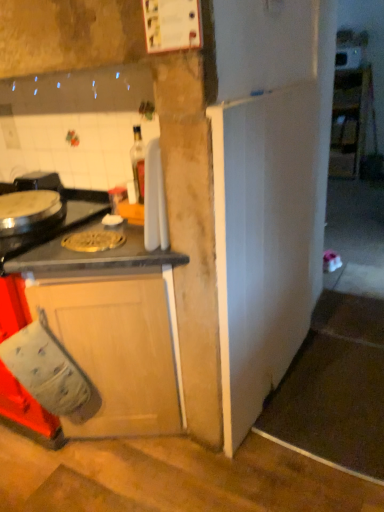
Where is `white glossy cabinet at upper right, marked as the second cabinetry in a left-to-right arrangement`? white glossy cabinet at upper right, marked as the second cabinetry in a left-to-right arrangement is located at coordinates (349, 121).

In order to face wooden cabinet at lower left, acting as the 2th cabinetry starting from the top, should I rotate leftwards or rightwards?

You should rotate left by 23.299 degrees.

You are a GUI agent. You are given a task and a screenshot of the screen. Output one action in this format:
    pyautogui.click(x=<x>, y=<y>)
    Task: Click on the shiny metallic burner at left
    
    Given the screenshot: What is the action you would take?
    pyautogui.click(x=58, y=221)

Measure the distance between gold metallic pizza pan at center and camera.

A distance of 1.47 meters exists between gold metallic pizza pan at center and camera.

The image size is (384, 512). Identify the location of white glossy cabinet at upper right, the first cabinetry positioned from the top. (349, 121).

From the picture: Which point is more distant from viewer, (332, 174) or (163, 256)?

The point (332, 174) is behind.

From the image's perspective, which one is positioned higher, white glossy cabinet at upper right, marked as the second cabinetry in a left-to-right arrangement, or wooden cabinet at lower left, acting as the 2th cabinetry starting from the top?

white glossy cabinet at upper right, marked as the second cabinetry in a left-to-right arrangement, appears higher in the image.

Between white glossy cabinet at upper right, the first cabinetry positioned from the top, and wooden cabinet at lower left, acting as the first cabinetry starting from the bottom, which one has less height?

wooden cabinet at lower left, acting as the first cabinetry starting from the bottom, is shorter.

Is white glossy cabinet at upper right, the first cabinetry positioned from the top, in front of or behind wooden cabinet at lower left, acting as the second cabinetry starting from the back, in the image?

In the image, white glossy cabinet at upper right, the first cabinetry positioned from the top, appears behind wooden cabinet at lower left, acting as the second cabinetry starting from the back.

Which is in front, point (80, 193) or point (100, 239)?

The point (100, 239) is closer.

Between shiny metallic burner at left and gold metallic pizza pan at center, which one has more height?

shiny metallic burner at left is taller.

From a real-world perspective, is shiny metallic burner at left above or below gold metallic pizza pan at center?

In terms of real-world spatial position, shiny metallic burner at left is above gold metallic pizza pan at center.

Measure the distance between shiny metallic burner at left and gold metallic pizza pan at center.

A distance of 7.88 inches exists between shiny metallic burner at left and gold metallic pizza pan at center.

Between gold metallic pizza pan at center and shiny metallic burner at left, which one has smaller size?

gold metallic pizza pan at center is smaller.

How much distance is there between gold metallic pizza pan at center and shiny metallic burner at left?

gold metallic pizza pan at center and shiny metallic burner at left are 7.88 inches apart from each other.

From a real-world perspective, does gold metallic pizza pan at center stand above shiny metallic burner at left?

No.

Is gold metallic pizza pan at center at the left side of shiny metallic burner at left?

Incorrect, gold metallic pizza pan at center is not on the left side of shiny metallic burner at left.

Would you say shiny metallic burner at left contains white glossy microwave at upper right?

No, white glossy microwave at upper right is not surrounded by shiny metallic burner at left.

In order to click on appliance above the shiny metallic burner at left (from the image's perspective) in this screenshot , I will do `click(348, 58)`.

Would you say shiny metallic burner at left is to the left or to the right of white glossy microwave at upper right in the picture?

shiny metallic burner at left is to the left of white glossy microwave at upper right.

Could you tell me if shiny metallic burner at left is turned towards white glossy microwave at upper right?

No.

Does white glossy microwave at upper right turn towards white glossy cabinet at upper right, placed as the second cabinetry when sorted from bottom to top?

No.

From a real-world perspective, which is physically above, white glossy microwave at upper right or white glossy cabinet at upper right, acting as the 1th cabinetry starting from the back?

white glossy microwave at upper right is physically above.

Based on the photo, who is bigger, white glossy microwave at upper right or white glossy cabinet at upper right, placed as the second cabinetry when sorted from bottom to top?

Bigger between the two is white glossy cabinet at upper right, placed as the second cabinetry when sorted from bottom to top.

This screenshot has height=512, width=384. What are the coordinates of `appliance located behind the white glossy cabinet at upper right, placed as the second cabinetry when sorted from bottom to top` in the screenshot? It's located at (348, 58).

Considering the relative sizes of shiny metallic burner at left and white glossy cabinet at upper right, acting as the 1th cabinetry starting from the back, in the image provided, is shiny metallic burner at left bigger than white glossy cabinet at upper right, acting as the 1th cabinetry starting from the back,?

No.

From a real-world perspective, is shiny metallic burner at left physically above white glossy cabinet at upper right, marked as the second cabinetry in a left-to-right arrangement?

Yes, from a real-world perspective, shiny metallic burner at left is over white glossy cabinet at upper right, marked as the second cabinetry in a left-to-right arrangement

From the image's perspective, which is below, shiny metallic burner at left or white glossy cabinet at upper right, the first cabinetry positioned from the top?

shiny metallic burner at left appears lower in the image.

Which is more distant, (165, 318) or (357, 63)?

Positioned behind is point (357, 63).

Is wooden cabinet at lower left, acting as the 1th cabinetry starting from the front, placed right next to white glossy microwave at upper right?

They are not placed beside each other.

Does wooden cabinet at lower left, which is the second cabinetry in right-to-left order, turn towards white glossy microwave at upper right?

No, wooden cabinet at lower left, which is the second cabinetry in right-to-left order, is not turned towards white glossy microwave at upper right.

Where is `cabinetry to the right of wooden cabinet at lower left, acting as the first cabinetry starting from the bottom`? This screenshot has height=512, width=384. cabinetry to the right of wooden cabinet at lower left, acting as the first cabinetry starting from the bottom is located at coordinates (349, 121).

The image size is (384, 512). I want to click on pizza pan in front of the shiny metallic burner at left, so click(93, 240).

Based on their spatial positions, is wooden cabinet at lower left, acting as the first cabinetry starting from the bottom, or white glossy microwave at upper right further from white glossy cabinet at upper right, marked as the second cabinetry in a left-to-right arrangement?

wooden cabinet at lower left, acting as the first cabinetry starting from the bottom, is further to white glossy cabinet at upper right, marked as the second cabinetry in a left-to-right arrangement.

Considering their positions, is white glossy microwave at upper right positioned closer to white glossy cabinet at upper right, the second cabinetry from the front, than wooden cabinet at lower left, acting as the 2th cabinetry starting from the top?

white glossy microwave at upper right is positioned closer to the anchor white glossy cabinet at upper right, the second cabinetry from the front.

Based on their spatial positions, is white glossy cabinet at upper right, marked as the 1th cabinetry in a right-to-left arrangement, or gold metallic pizza pan at center further from shiny metallic burner at left?

white glossy cabinet at upper right, marked as the 1th cabinetry in a right-to-left arrangement, is further to shiny metallic burner at left.

Based on the photo, considering their positions, is white glossy microwave at upper right positioned closer to wooden cabinet at lower left, the 1th cabinetry viewed from the left, than gold metallic pizza pan at center?

gold metallic pizza pan at center lies closer to wooden cabinet at lower left, the 1th cabinetry viewed from the left, than the other object.

Which object lies further to the anchor point white glossy cabinet at upper right, placed as the second cabinetry when sorted from bottom to top, white glossy microwave at upper right or shiny metallic burner at left?

shiny metallic burner at left is positioned further to the anchor white glossy cabinet at upper right, placed as the second cabinetry when sorted from bottom to top.

Estimate the real-world distances between objects in this image. Which object is further from shiny metallic burner at left, wooden cabinet at lower left, the 1th cabinetry viewed from the left, or white glossy microwave at upper right?

The object further to shiny metallic burner at left is white glossy microwave at upper right.

Considering their positions, is white glossy cabinet at upper right, marked as the 1th cabinetry in a right-to-left arrangement, positioned further to gold metallic pizza pan at center than white glossy microwave at upper right?

white glossy microwave at upper right lies further to gold metallic pizza pan at center than the other object.

When comparing their distances from wooden cabinet at lower left, acting as the 1th cabinetry starting from the front, does shiny metallic burner at left or white glossy cabinet at upper right, the first cabinetry positioned from the top, seem further?

Based on the image, white glossy cabinet at upper right, the first cabinetry positioned from the top, appears to be further to wooden cabinet at lower left, acting as the 1th cabinetry starting from the front.

Where is `cabinetry between gold metallic pizza pan at center and white glossy microwave at upper right in the front-back direction`? cabinetry between gold metallic pizza pan at center and white glossy microwave at upper right in the front-back direction is located at coordinates (349, 121).

Find the location of a particular element. The height and width of the screenshot is (512, 384). gas stove between wooden cabinet at lower left, which is the second cabinetry in right-to-left order, and white glossy cabinet at upper right, marked as the 1th cabinetry in a right-to-left arrangement, along the z-axis is located at coordinates (58, 221).

Find the location of `gas stove between gold metallic pizza pan at center and white glossy microwave at upper right from front to back`. gas stove between gold metallic pizza pan at center and white glossy microwave at upper right from front to back is located at coordinates (58, 221).

I want to click on pizza pan between wooden cabinet at lower left, which is the second cabinetry in right-to-left order, and white glossy microwave at upper right in the front-back direction, so (93, 240).